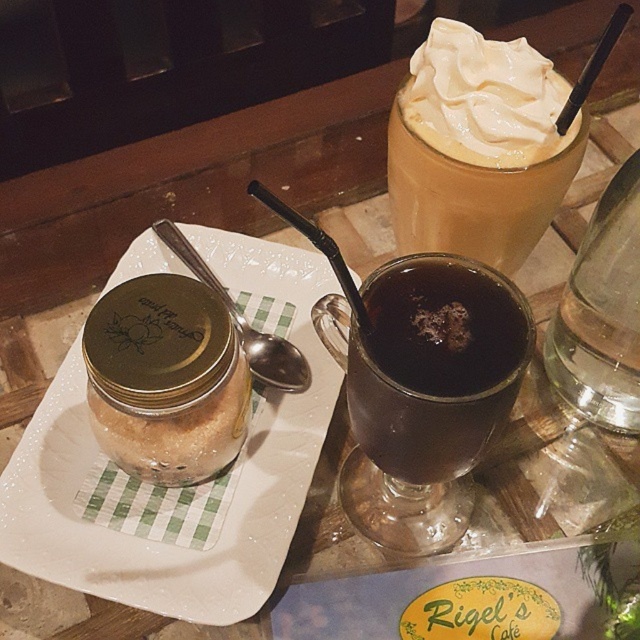
How distant is dark brown glass mug at center from translucent glass cup at upper right?

4.26 inches

Who is more distant from viewer, (426, 317) or (560, 380)?

Positioned behind is point (560, 380).

Between point (413, 332) and point (602, 298), which one is positioned behind?

Point (602, 298)

Locate an element on the screen. This screenshot has width=640, height=640. dark brown glass mug at center is located at coordinates (426, 392).

Is dark glass cup at center shorter than silver metallic spoon at upper left?

Indeed, dark glass cup at center has a lesser height compared to silver metallic spoon at upper left.

Can you confirm if dark glass cup at center is thinner than silver metallic spoon at upper left?

Correct, dark glass cup at center's width is less than silver metallic spoon at upper left's.

Based on the photo, who is more forward, (x=504, y=282) or (x=243, y=332)?

Point (x=504, y=282)

What are the coordinates of `dark glass cup at center` in the screenshot? It's located at (444, 324).

Who is lower down, whipped cream at upper right or translucent glass cup at upper right?

translucent glass cup at upper right is lower down.

Who is shorter, whipped cream at upper right or translucent glass cup at upper right?

whipped cream at upper right

The image size is (640, 640). What do you see at coordinates (484, 99) in the screenshot? I see `whipped cream at upper right` at bounding box center [484, 99].

At what (x,y) coordinates should I click in order to perform the action: click on whipped cream at upper right. Please return your answer as a coordinate pair (x, y). This screenshot has width=640, height=640. Looking at the image, I should click on (484, 99).